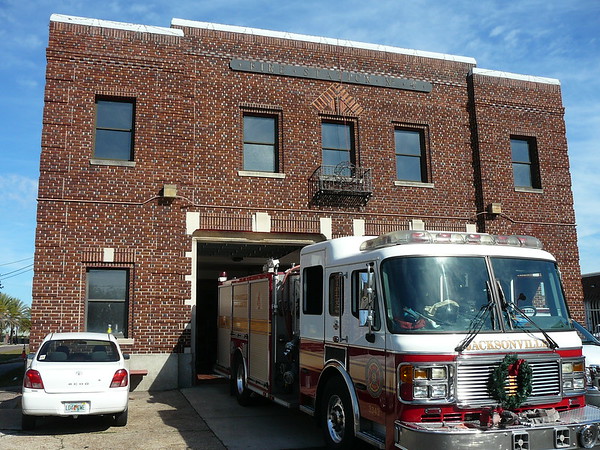
Find the location of a particular element. The image size is (600, 450). window is located at coordinates (411, 165).